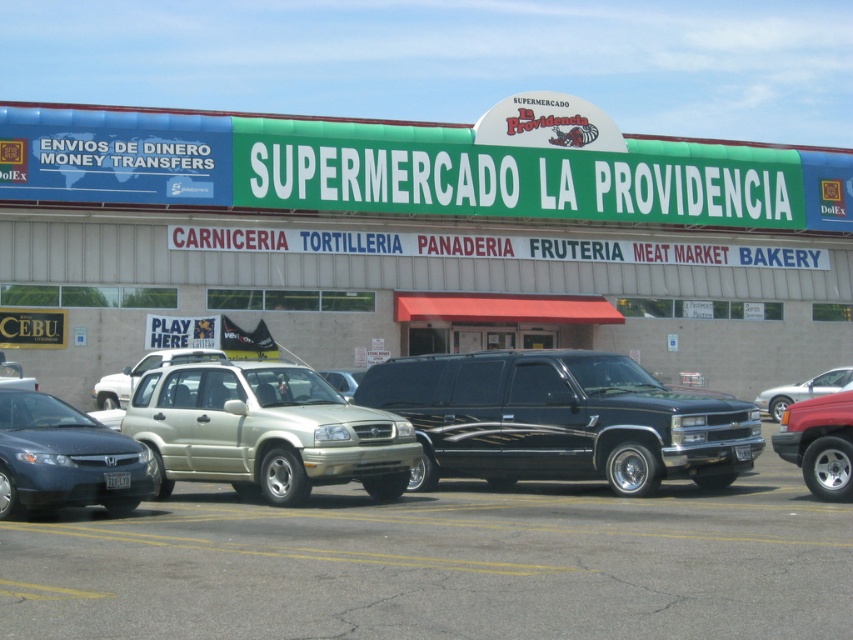
Question: Is metallic silver suv at center smaller than black metallic suv at center?

Choices:
 (A) no
 (B) yes

Answer: (A)

Question: Is metallic gold suv at center wider than silver metallic sedan at right?

Choices:
 (A) no
 (B) yes

Answer: (B)

Question: Which object is positioned farthest from the gold matte suv at center?

Choices:
 (A) metallic red truck at right
 (B) metallic gold suv at center

Answer: (B)

Question: Is gold matte suv at center wider than metallic red truck at right?

Choices:
 (A) no
 (B) yes

Answer: (B)

Question: Which object appears farthest from the camera in this image?

Choices:
 (A) metallic silver suv at center
 (B) silver metallic sedan at right

Answer: (B)

Question: Which point is closer to the camera taking this photo?

Choices:
 (A) [x=807, y=410]
 (B) [x=303, y=285]
 (C) [x=99, y=502]
 (D) [x=448, y=408]

Answer: (C)